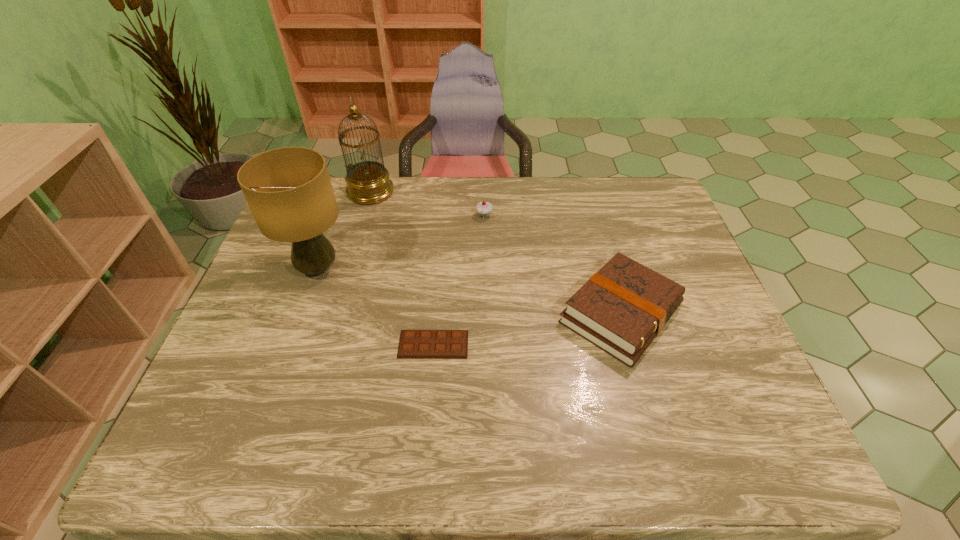
The height and width of the screenshot is (540, 960). I want to click on vacant point that satisfies the following two spatial constraints: 1. with an open door on the birdcage; 2. on the left side of the second farthest object, so click(x=364, y=215).

Find the location of `free space that satisfies the following two spatial constraints: 1. with an open door on the fourth tallest object; 2. on the right side of the birdcage`. free space that satisfies the following two spatial constraints: 1. with an open door on the fourth tallest object; 2. on the right side of the birdcage is located at coordinates (334, 313).

In order to click on vacant region that satisfies the following two spatial constraints: 1. on the back side of the cupcake; 2. on the left side of the chocolate bar in this screenshot , I will do `click(444, 215)`.